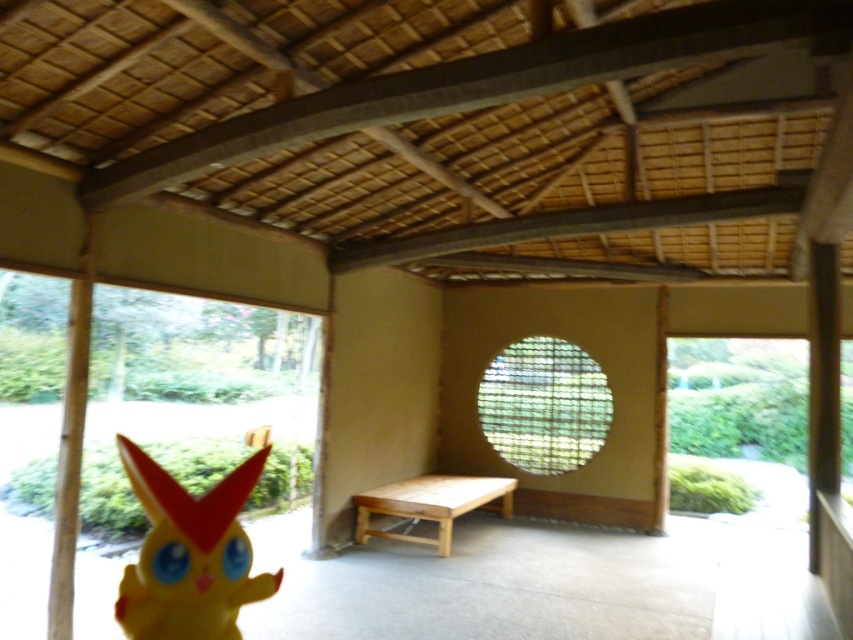
Question: Which point is farther to the camera?

Choices:
 (A) wooden bench at center
 (B) yellow matte plush at lower left

Answer: (A)

Question: Which object is closer to the camera taking this photo?

Choices:
 (A) yellow matte plush at lower left
 (B) wooden bench at center

Answer: (A)

Question: Among these points, which one is nearest to the camera?

Choices:
 (A) (212, 572)
 (B) (361, 515)

Answer: (A)

Question: Is yellow matte plush at lower left thinner than wooden bench at center?

Choices:
 (A) yes
 (B) no

Answer: (A)

Question: Is yellow matte plush at lower left closer to camera compared to wooden bench at center?

Choices:
 (A) no
 (B) yes

Answer: (B)

Question: Does yellow matte plush at lower left have a lesser width compared to wooden bench at center?

Choices:
 (A) yes
 (B) no

Answer: (A)